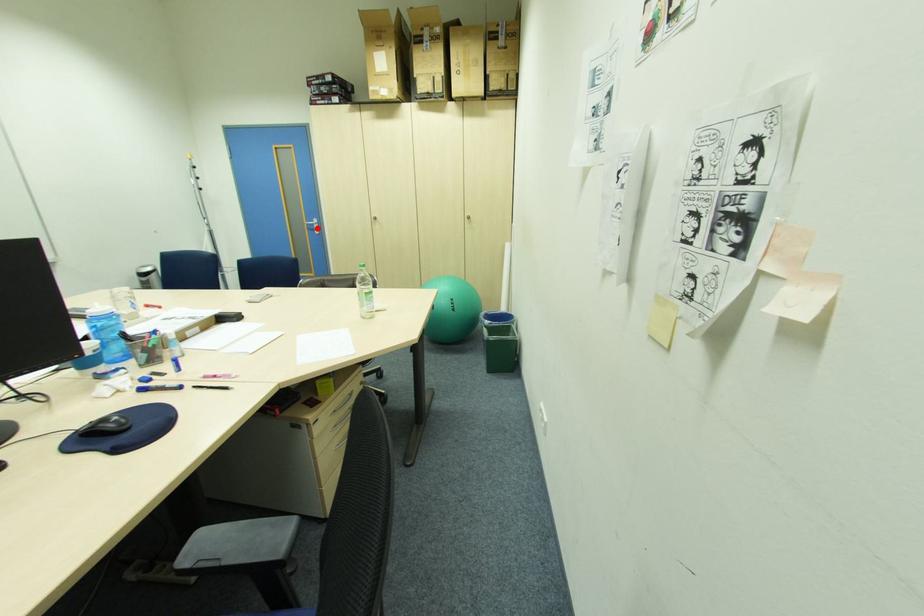
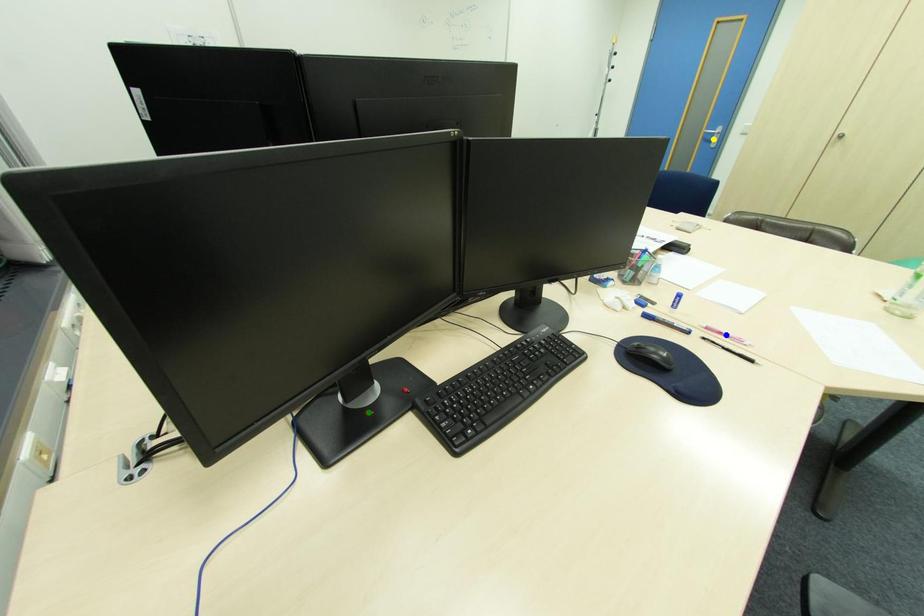
Question: I am providing you with two images of the same scene from different viewpoints. A red point is marked on the first image. You are given multiple points on the second image. Which spot in image 2 lines up with the point in image 1?

Choices:
 (A) yellow point
 (B) green point
 (C) blue point

Answer: (A)